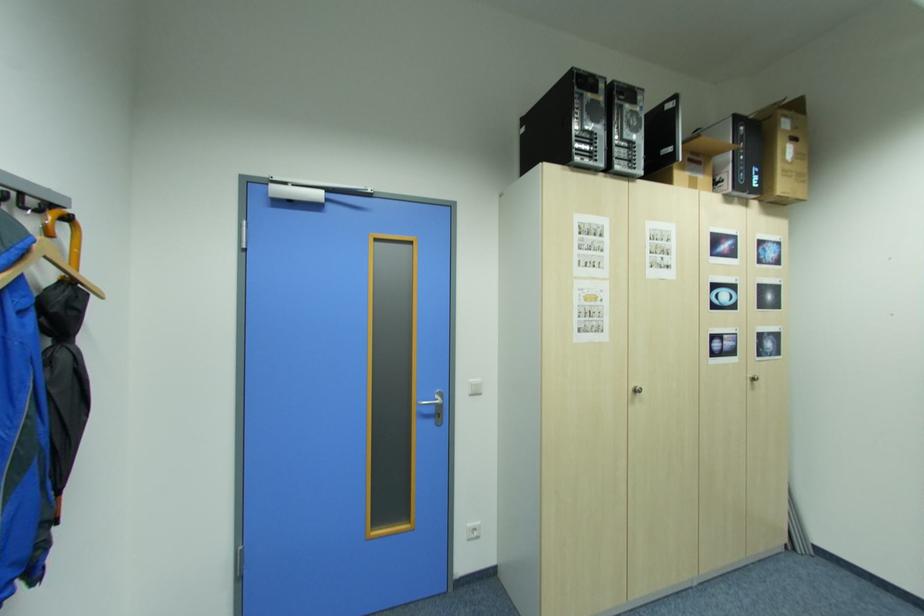
This screenshot has width=924, height=616. I want to click on cardboard box, so click(784, 151).